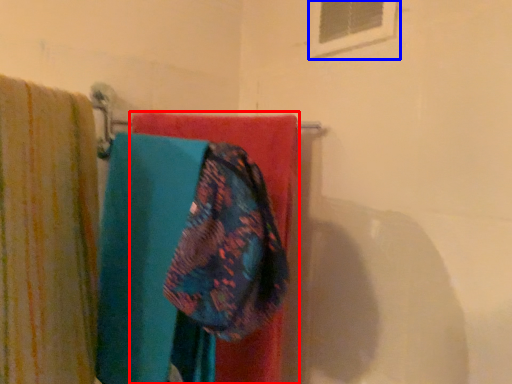
Question: Which object is further to the camera taking this photo, towel (highlighted by a red box) or window (highlighted by a blue box)?

Choices:
 (A) towel
 (B) window

Answer: (B)